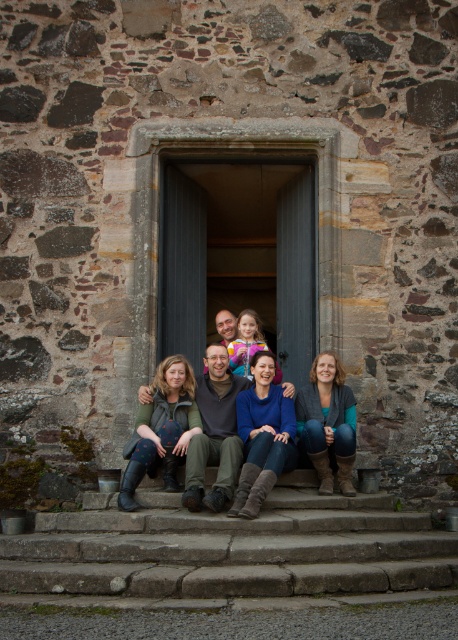
Question: Which object appears closest to the camera in this image?

Choices:
 (A) blue denim jeans at center
 (B) stone steps at center

Answer: (B)

Question: Is stone steps at center positioned before blue denim jeans at center?

Choices:
 (A) no
 (B) yes

Answer: (B)

Question: Does stone steps at center appear under blue denim jeans at center?

Choices:
 (A) no
 (B) yes

Answer: (B)

Question: Can you confirm if stone steps at center is positioned below blue denim jeans at center?

Choices:
 (A) yes
 (B) no

Answer: (A)

Question: Which point is closer to the camera?

Choices:
 (A) stone steps at center
 (B) blue denim jeans at center

Answer: (A)